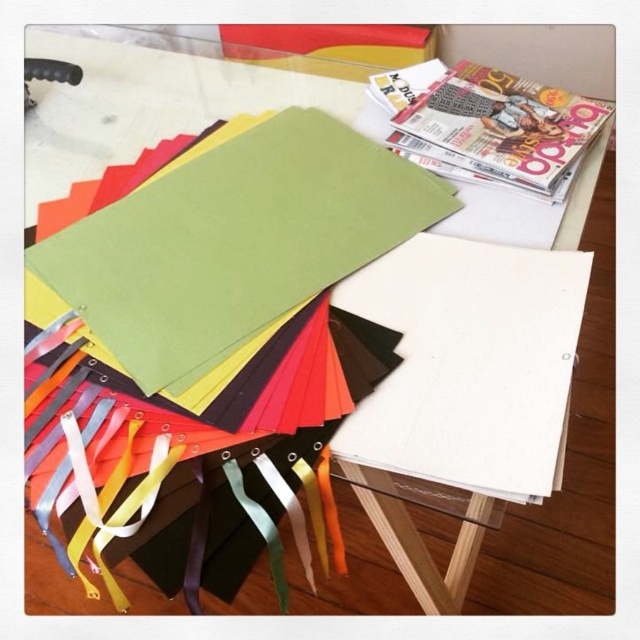
Does green matte paper at upper center have a lesser height compared to matte paper magazine at upper right?

In fact, green matte paper at upper center may be taller than matte paper magazine at upper right.

Does point (67, 227) come closer to viewer compared to point (403, 124)?

Yes, point (67, 227) is closer to viewer.

Who is more forward, (202, 212) or (572, 116)?

Point (202, 212) is more forward.

I want to click on green matte paper at upper center, so click(232, 243).